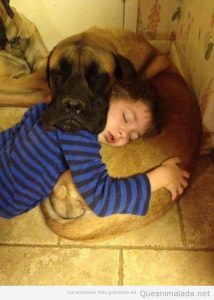
The image size is (214, 300). What are the coordinates of `hard floor` in the screenshot? It's located at (90, 271), (156, 258).